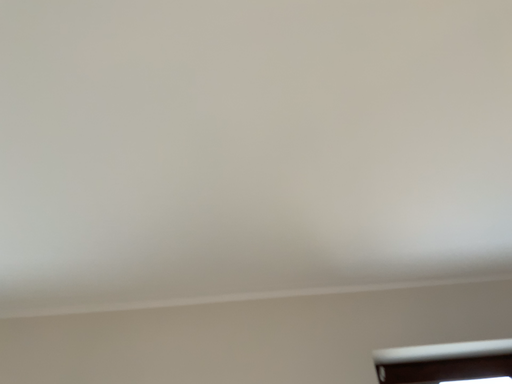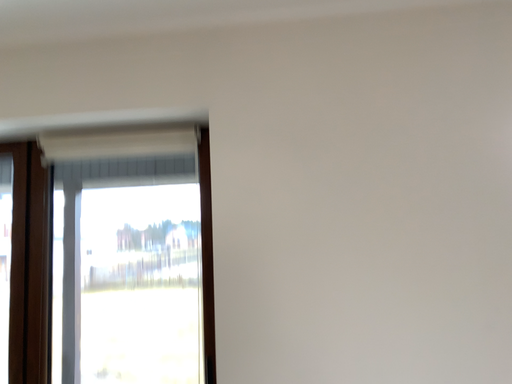
Question: How did the camera likely rotate when shooting the video?

Choices:
 (A) rotated left
 (B) rotated right

Answer: (A)